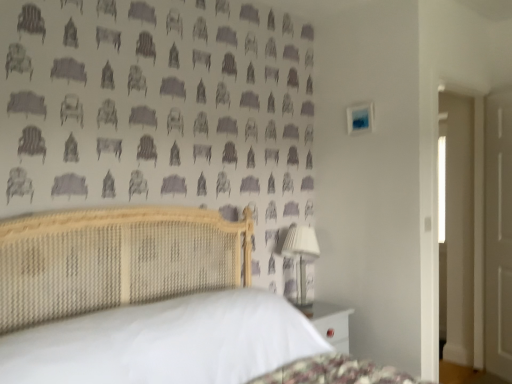
Where is `white fabric-covered lampshade at right`? This screenshot has height=384, width=512. white fabric-covered lampshade at right is located at coordinates (301, 257).

Describe the element at coordinates (109, 284) in the screenshot. The image size is (512, 384). I see `woven wood bed at center` at that location.

What is the approximate width of white matte door at right?

The width of white matte door at right is 3.62 inches.

What are the coordinates of `white fabric-covered lampshade at right` in the screenshot? It's located at (301, 257).

Can you tell me how much white matte door at right and white fabric-covered lampshade at right differ in facing direction?

The angular difference between white matte door at right and white fabric-covered lampshade at right is 109 degrees.

From a real-world perspective, is white matte door at right on top of white fabric-covered lampshade at right?

Yes, from a real-world perspective, white matte door at right is over white fabric-covered lampshade at right

Is white fabric-covered lampshade at right inside white matte door at right?

No, white fabric-covered lampshade at right is not surrounded by white matte door at right.

Consider the image. Is white matte door at right not close to white fabric-covered lampshade at right?

Yes, white matte door at right and white fabric-covered lampshade at right are quite far apart.

Which is more to the right, white fabric-covered lampshade at right or white matte door at right?

Positioned to the right is white matte door at right.

Is white fabric-covered lampshade at right looking in the opposite direction of white matte door at right?

That's not correct — white fabric-covered lampshade at right is not looking away from white matte door at right.

Looking at this image, between white fabric-covered lampshade at right and white matte door at right, which one has larger size?

white matte door at right is bigger.

Which of these two, white fabric-covered lampshade at right or white matte door at right, stands shorter?

Standing shorter between the two is white fabric-covered lampshade at right.

Can you tell me how much white matte door at right and woven wood bed at center differ in facing direction?

113 degrees separate the facing orientations of white matte door at right and woven wood bed at center.

Considering the relative sizes of white matte door at right and woven wood bed at center in the image provided, is white matte door at right smaller than woven wood bed at center?

Yes, white matte door at right is smaller than woven wood bed at center.

Is white matte door at right not within woven wood bed at center?

white matte door at right is positioned outside woven wood bed at center.

Between white matte door at right and woven wood bed at center, which one appears on the right side from the viewer's perspective?

white matte door at right.

Is woven wood bed at center turned away from white fabric-covered lampshade at right?

That's not correct — woven wood bed at center is not looking away from white fabric-covered lampshade at right.

Considering the points (51, 284) and (289, 250), which point is in front, point (51, 284) or point (289, 250)?

The point (51, 284) is closer.

Would you say woven wood bed at center is a long distance from white fabric-covered lampshade at right?

That's not correct — woven wood bed at center is a little close to white fabric-covered lampshade at right.

This screenshot has width=512, height=384. I want to click on bed positioned vertically above the white fabric-covered lampshade at right (from a real-world perspective), so click(109, 284).

Is white fabric-covered lampshade at right at the left side of woven wood bed at center?

Incorrect, white fabric-covered lampshade at right is not on the left side of woven wood bed at center.

The image size is (512, 384). Identify the location of bed that is in front of the white fabric-covered lampshade at right. (109, 284).

Considering the points (296, 244) and (207, 310), which point is in front, point (296, 244) or point (207, 310)?

The point (207, 310) is in front.

From the image's perspective, is white fabric-covered lampshade at right located above woven wood bed at center?

Actually, white fabric-covered lampshade at right appears below woven wood bed at center in the image.

Does woven wood bed at center have a lesser width compared to white matte door at right?

In fact, woven wood bed at center might be wider than white matte door at right.

Is woven wood bed at center inside or outside of white matte door at right?

woven wood bed at center is outside white matte door at right.

Can you tell me how much woven wood bed at center and white matte door at right differ in facing direction?

woven wood bed at center and white matte door at right are facing 113 degrees away from each other.

Does woven wood bed at center have a smaller size compared to white matte door at right?

Incorrect, woven wood bed at center is not smaller in size than white matte door at right.

In order to click on door on the right of white fabric-covered lampshade at right in this screenshot , I will do `click(498, 234)`.

The image size is (512, 384). I want to click on table lamp to the left of white matte door at right, so tap(301, 257).

From the image, which object appears to be nearer to white fabric-covered lampshade at right, white matte door at right or woven wood bed at center?

woven wood bed at center is closer to white fabric-covered lampshade at right.

Considering their positions, is white fabric-covered lampshade at right positioned closer to white matte door at right than woven wood bed at center?

Based on the image, white fabric-covered lampshade at right appears to be nearer to white matte door at right.

Considering their positions, is white matte door at right positioned closer to woven wood bed at center than white fabric-covered lampshade at right?

Among the two, white fabric-covered lampshade at right is located nearer to woven wood bed at center.

Based on their spatial positions, is woven wood bed at center or white matte door at right closer to white fabric-covered lampshade at right?

Based on the image, woven wood bed at center appears to be nearer to white fabric-covered lampshade at right.

When comparing their distances from white matte door at right, does woven wood bed at center or white fabric-covered lampshade at right seem closer?

white fabric-covered lampshade at right.

Estimate the real-world distances between objects in this image. Which object is closer to woven wood bed at center, white fabric-covered lampshade at right or white matte door at right?

white fabric-covered lampshade at right is positioned closer to the anchor woven wood bed at center.

Where is `table lamp between woven wood bed at center and white matte door at right along the z-axis`? This screenshot has width=512, height=384. table lamp between woven wood bed at center and white matte door at right along the z-axis is located at coordinates (301, 257).